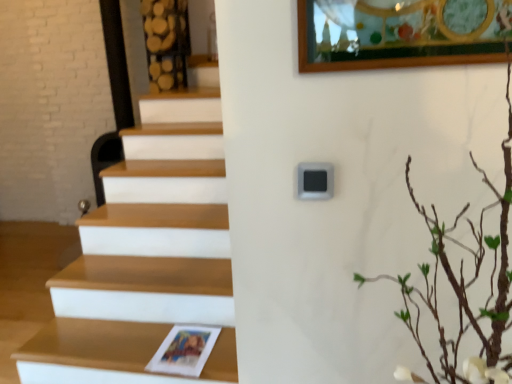
The height and width of the screenshot is (384, 512). I want to click on blank space above wooden at lower left (from a real-world perspective), so click(x=142, y=336).